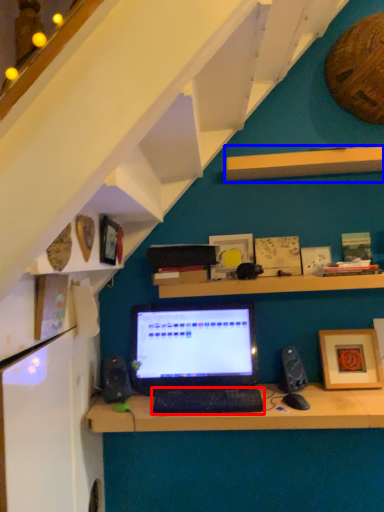
Question: Among these objects, which one is farthest to the camera, computer keyboard (highlighted by a red box) or shelf (highlighted by a blue box)?

Choices:
 (A) computer keyboard
 (B) shelf

Answer: (B)